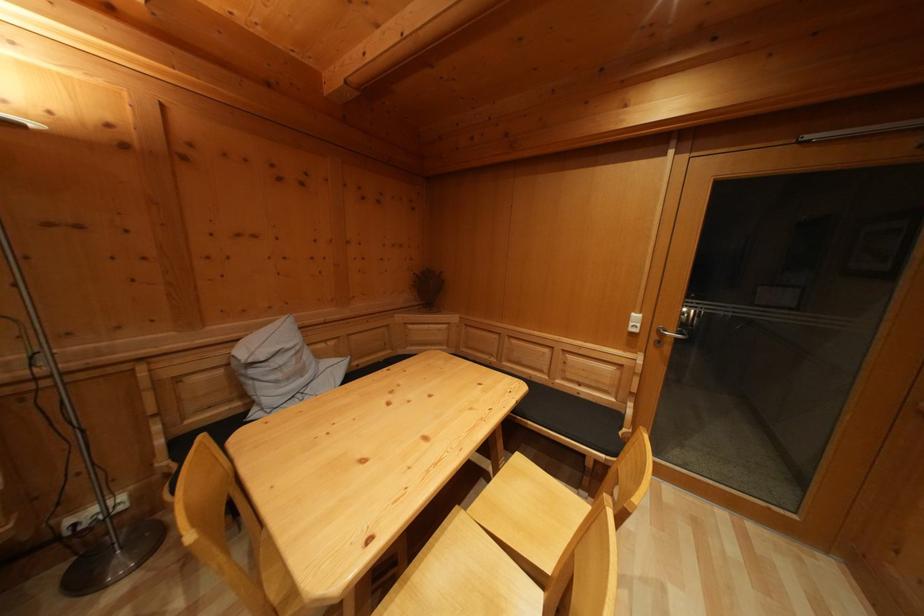
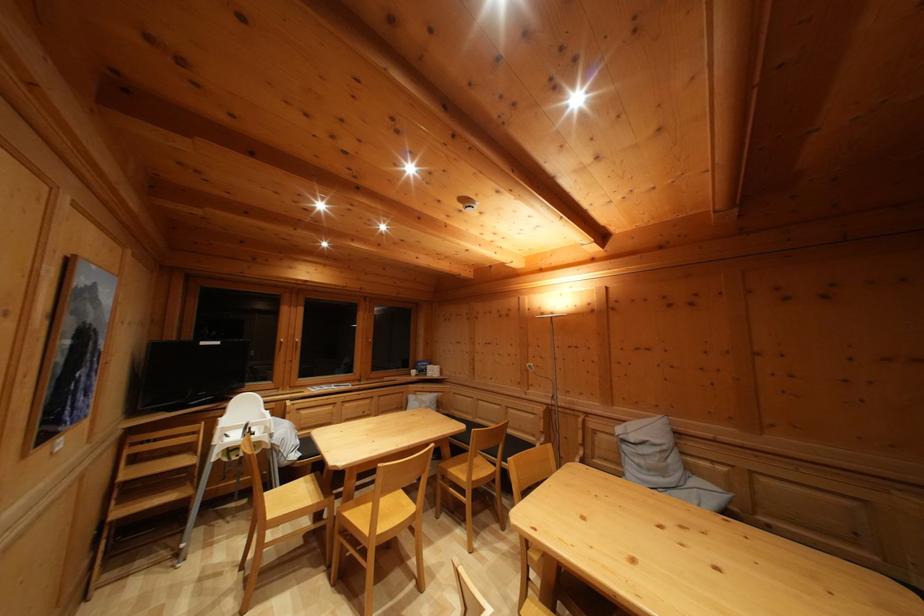
The point at (258, 379) is marked in the first image. Where is the corresponding point in the second image?

(629, 454)